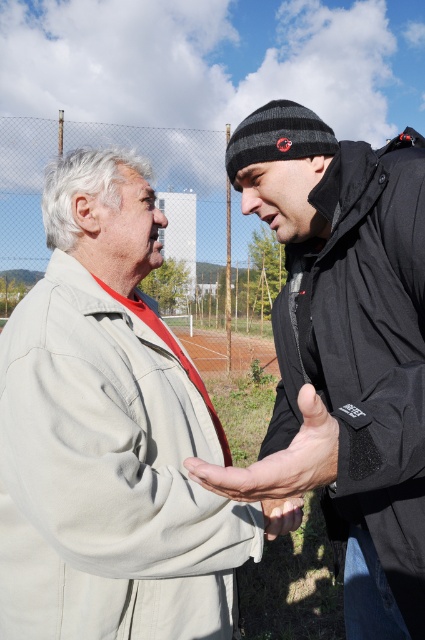
Between black matte jacket at center and dry skin hand at center, which one has less height?

With less height is dry skin hand at center.

Between point (282, 209) and point (241, 486), which one is positioned in front?

Point (241, 486) is more forward.

The height and width of the screenshot is (640, 425). I want to click on black matte jacket at center, so click(x=343, y=349).

Between point (153, 256) and point (224, 486), which one is positioned in front?

Positioned in front is point (224, 486).

Is point (76, 349) in front of point (241, 477)?

No.

Find the location of a particular element. The image size is (425, 640). beige cotton jacket at center is located at coordinates (108, 435).

Which is in front, point (263, 460) or point (278, 531)?

Point (263, 460) is in front.

Which is above, dry skin hand at center or smooth skin hand at center?

dry skin hand at center is higher up.

Is point (331, 470) behind point (269, 536)?

No.

Find the location of a particular element. dry skin hand at center is located at coordinates [x=280, y=460].